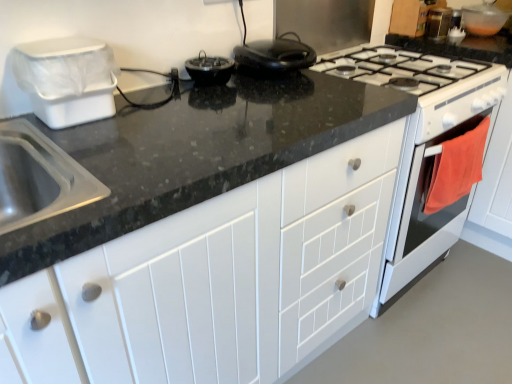
Where is `vacant space in front of white plastic bin at left, the first appliance when ordered from left to right`? The width and height of the screenshot is (512, 384). vacant space in front of white plastic bin at left, the first appliance when ordered from left to right is located at coordinates (76, 150).